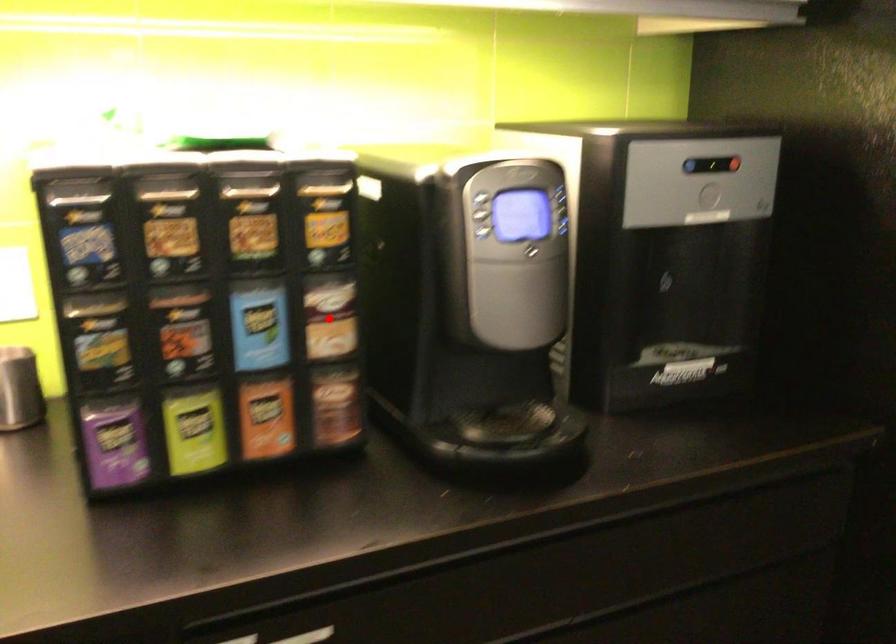
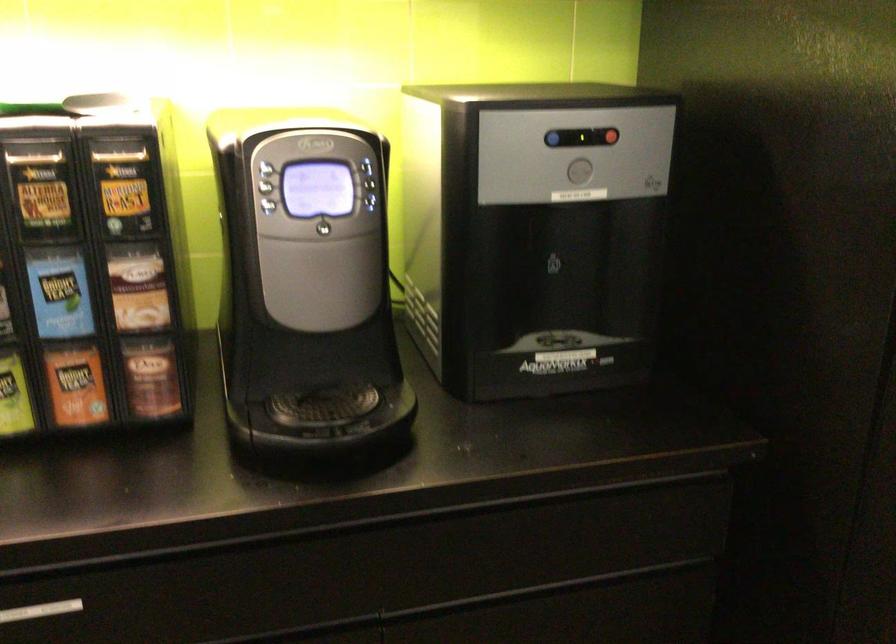
In the second image, find the point that corresponds to the highlighted location in the first image.

(138, 287)